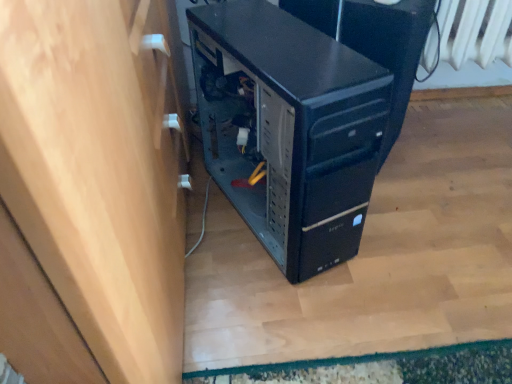
Identify the location of free space in front of black plastic computer tower at center. The width and height of the screenshot is (512, 384). (298, 309).